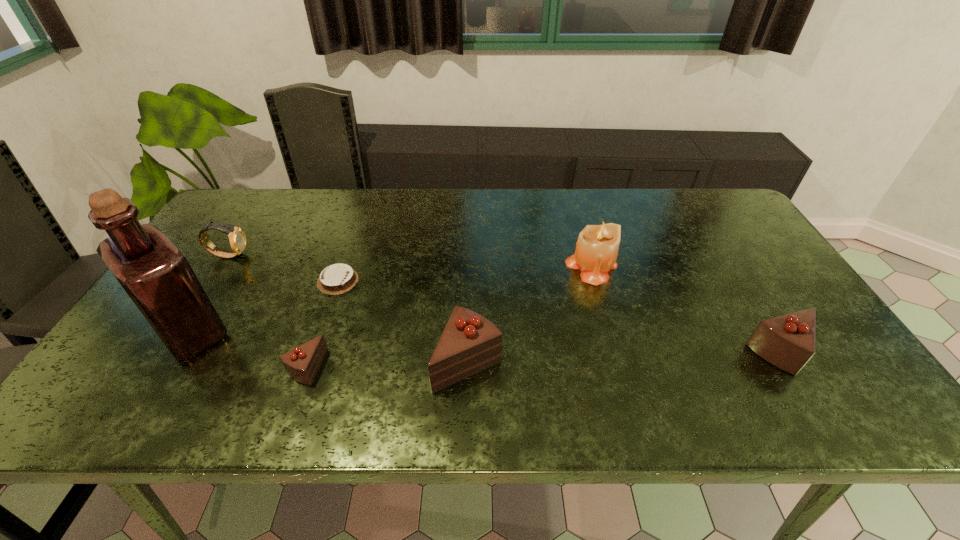
The width and height of the screenshot is (960, 540). Find the location of `vacant space that is in between the third object from right to left and the liquor`. vacant space that is in between the third object from right to left and the liquor is located at coordinates (329, 347).

Where is `free space between the shortest object and the watch`? Image resolution: width=960 pixels, height=540 pixels. free space between the shortest object and the watch is located at coordinates (283, 268).

You are a GUI agent. You are given a task and a screenshot of the screen. Output one action in this format:
    pyautogui.click(x=<x>, y=<y>)
    Task: Click on the vacant region between the farthest chocolate cake and the candle
    This screenshot has width=960, height=540.
    Given the screenshot: What is the action you would take?
    pyautogui.click(x=465, y=273)

What are the coordinates of `free space that is in between the rightmost object and the watch` in the screenshot? It's located at (505, 303).

Locate an element on the screen. vacant area that lies between the second shortest chocolate cake and the tallest object is located at coordinates tap(249, 349).

The image size is (960, 540). I want to click on vacant space in between the rightmost object and the watch, so click(x=505, y=303).

What are the coordinates of `free space that is in between the second shortest object and the third object from right to left` in the screenshot? It's located at (387, 364).

Identify the location of vacant region between the liquor and the farthest chocolate cake. (265, 306).

Locate which object ranks sixth in proximity to the rightmost chocolate cake. Please provide its 2D coordinates. Your answer should be formatted as a tuple, i.e. [(x, y)], where the tuple contains the x and y coordinates of a point satisfying the conditions above.

[(237, 238)]

Find the location of a particular element. object that stands as the third closest to the second tallest object is located at coordinates (338, 278).